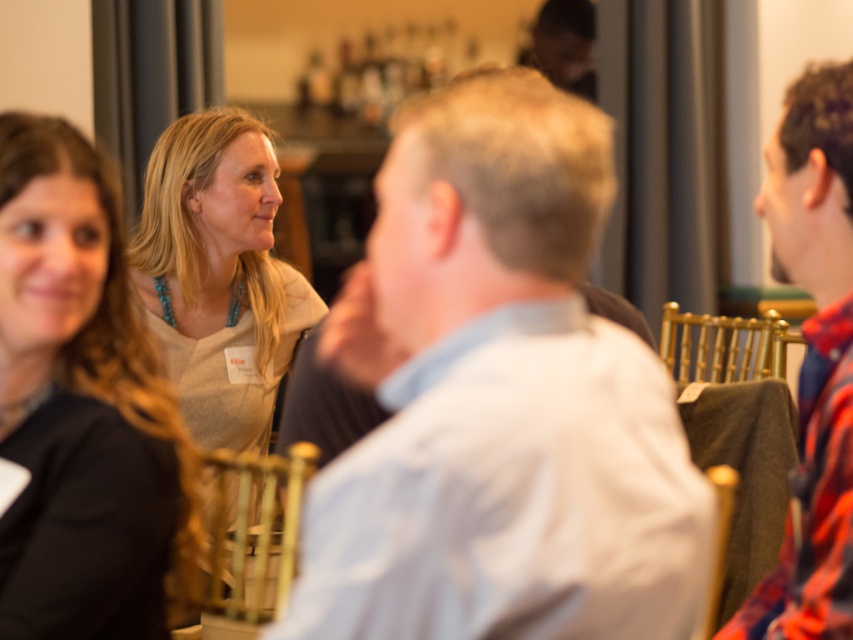
You are a photographer adjusting camera settings to capture the group photo. The matte gray sweater at upper left and the flannel shirt at right are both in the frame. Which one appears shorter in the photo?

The matte gray sweater at upper left appears shorter in the photo because it has a lesser height compared to the flannel shirt at right.

You are a photographer standing at the center of the room. You want to take a photo of the matte gray sweater at upper left and the flannel shirt at right. The camera has a maximum focus range of 40 inches. Can you capture both items in focus without moving the camera?

The matte gray sweater at upper left is 38.48 inches away from the flannel shirt at right. Since the distance between them is within the camera maximum focus range of 40 inches, you can capture both items in focus without moving the camera.

You are an event organizer who needs to arrange name tags for attendees. You see two sweaters, the matte gray sweater at upper left and the light beige sweater at center. Which sweater is closer to the top of the image?

The light beige sweater at center is closer to the top of the image because the matte gray sweater at upper left is positioned under it.